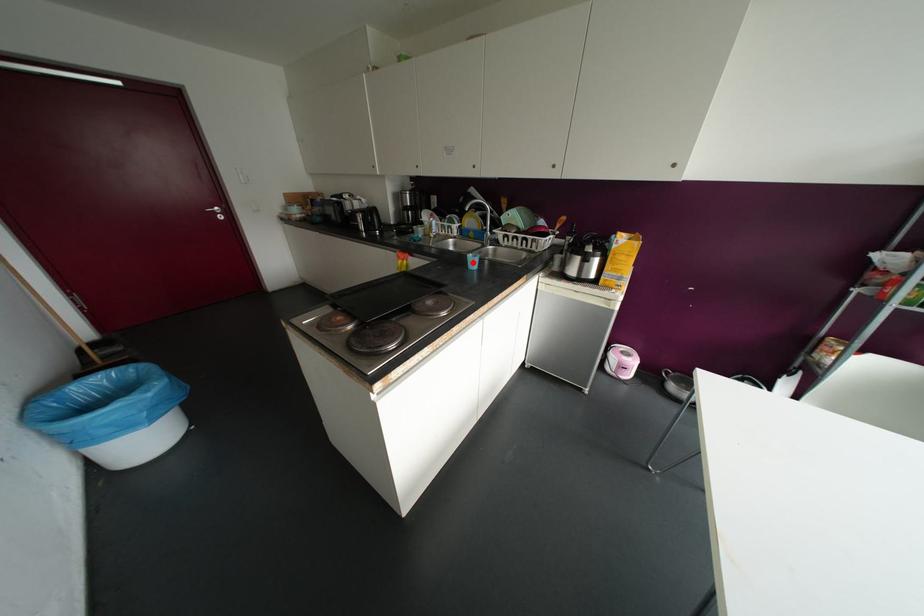
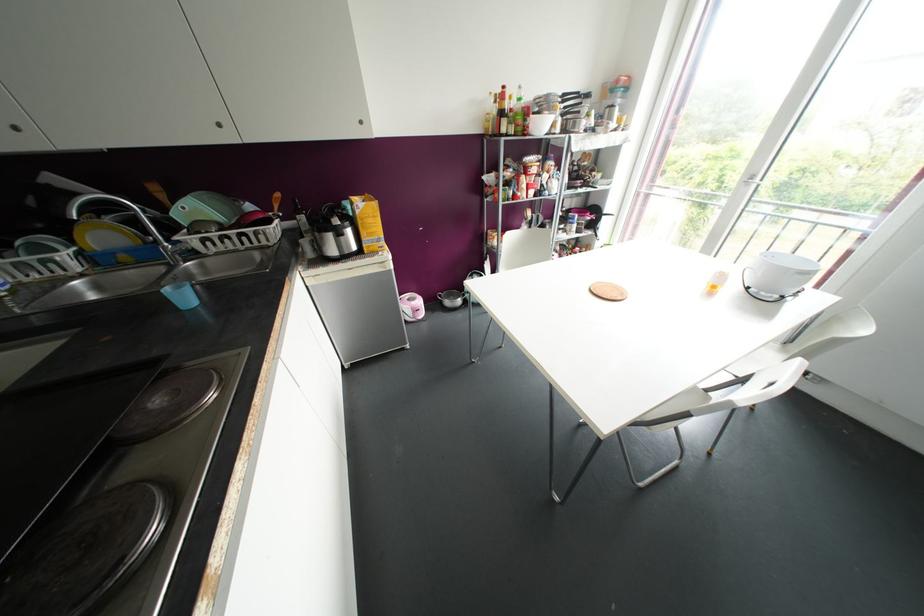
Find the pixel in the second image that matches the highlighted location in the first image.

(184, 297)